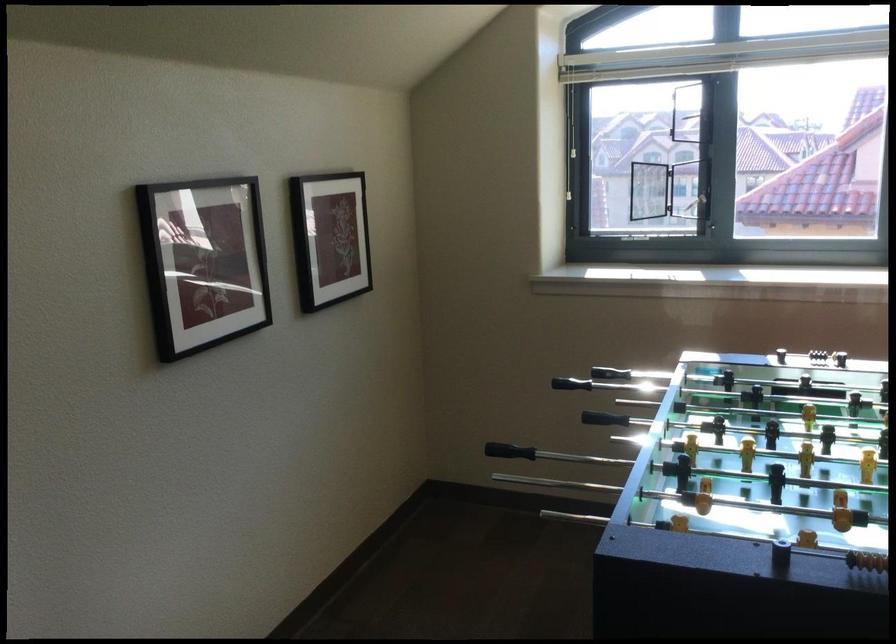
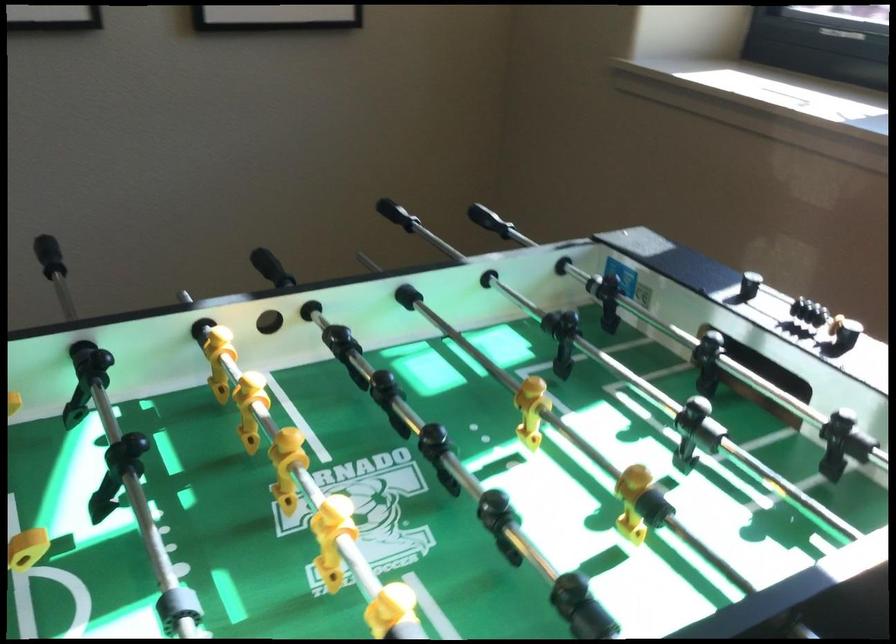
Locate, in the second image, the point that corresponds to pixel 434 397 in the first image.

(488, 220)